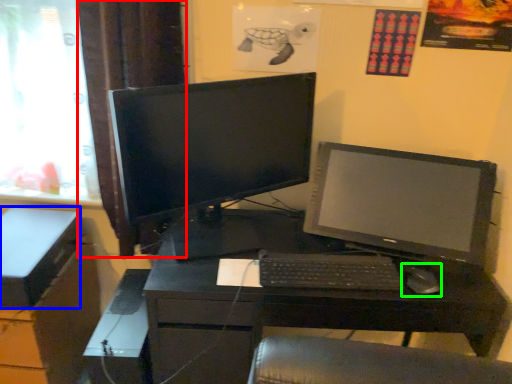
Question: Which object is positioned farthest from curtain (highlighted by a red box)? Select from box (highlighted by a blue box) and mouse (highlighted by a green box).

Choices:
 (A) box
 (B) mouse

Answer: (B)